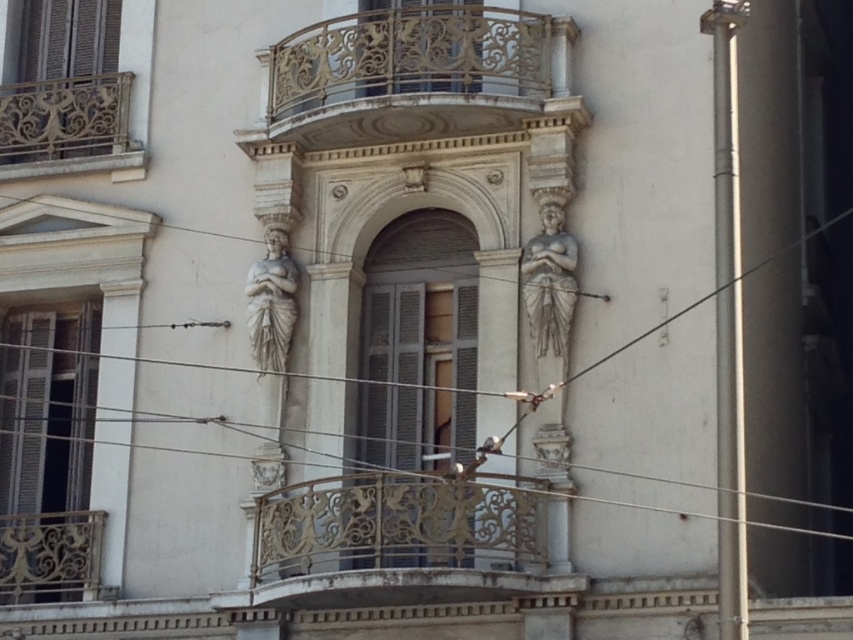
Does gold ornate railing at upper left have a lesser height compared to gray stone statue at center?

Correct, gold ornate railing at upper left is not as tall as gray stone statue at center.

Is point (105, 124) positioned in front of point (267, 310)?

No, it is behind (267, 310).

Find the location of a particular element. The width and height of the screenshot is (853, 640). gold ornate railing at upper left is located at coordinates (67, 128).

Is gold ornate railing at center further to the viewer compared to gold ornate railing at upper left?

No, gold ornate railing at center is closer to the viewer.

Between point (519, 557) and point (82, 93), which one is positioned behind?

The point (82, 93) is more distant.

From the picture: Who is more distant from viewer, (328, 548) or (70, 83)?

Positioned behind is point (70, 83).

At what (x,y) coordinates should I click in order to perform the action: click on gold ornate railing at center. Please return your answer as a coordinate pair (x, y). The image size is (853, 640). Looking at the image, I should click on (399, 541).

How distant is gold ornate railing at center from gray stone statue at center?

gold ornate railing at center and gray stone statue at center are 11.11 meters apart.

Does gold ornate railing at center have a larger size compared to gray stone statue at center?

Incorrect, gold ornate railing at center is not larger than gray stone statue at center.

Is point (456, 515) positioned in front of point (289, 257)?

That is True.

You are a GUI agent. You are given a task and a screenshot of the screen. Output one action in this format:
    pyautogui.click(x=<x>, y=<y>)
    Task: Click on the gold ornate railing at center
    The height and width of the screenshot is (640, 853).
    Given the screenshot: What is the action you would take?
    pyautogui.click(x=399, y=541)